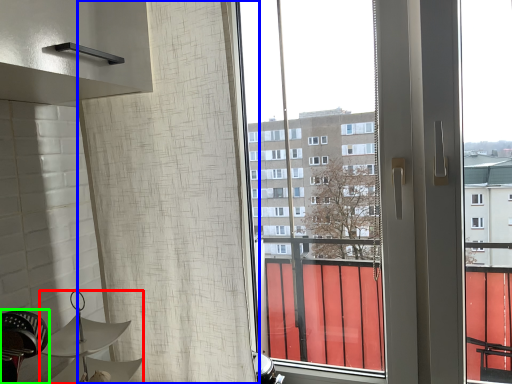
Question: Which is nearer to the lamp (highlighted by a red box)? shower curtain (highlighted by a blue box) or swivel chair (highlighted by a green box).

Choices:
 (A) shower curtain
 (B) swivel chair

Answer: (B)